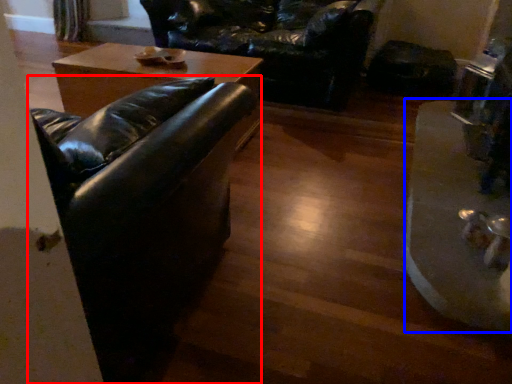
Question: Which object appears farthest to the camera in this image, studio couch (highlighted by a red box) or wide (highlighted by a blue box)?

Choices:
 (A) studio couch
 (B) wide

Answer: (B)